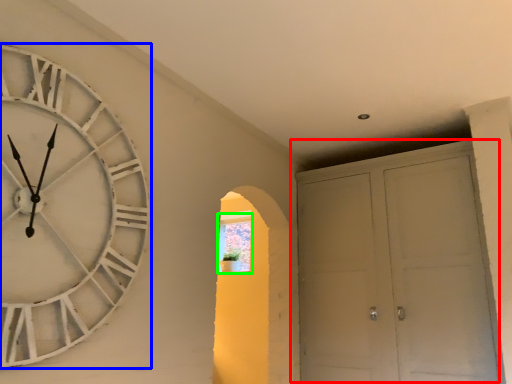
Question: Estimate the real-world distances between objects in this image. Which object is farther from door (highlighted by a red box), wall clock (highlighted by a blue box) or window (highlighted by a green box)?

Choices:
 (A) wall clock
 (B) window

Answer: (A)